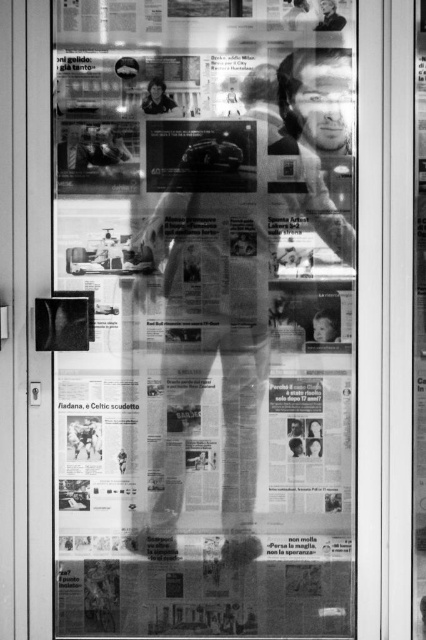
You are a graphic designer who needs to ensure that the printed paper poster at center is visible over the smooth skin person at upper center. Based on their heights, will the poster cover the person?

The printed paper poster at center has a greater height compared to smooth skin person at upper center, so yes, the poster will cover the person.

You are a graphic designer who needs to place a new advertisement on the printed paper poster at center. However, you notice the smooth skin person at upper center is partially covering it. Can you still access the poster without moving the person?

The printed paper poster at center is positioned under the smooth skin person at upper center, so you can access the poster by moving it from below the person without needing to move them.

You are a delivery person who needs to place a 24 inch wide package between the printed paper poster at center and the smooth skin person at upper center. Can the package fit in the space between them?

The distance between the printed paper poster at center and the smooth skin person at upper center is 23.04 inches. Since the package is 24 inches wide, it cannot fit in the space between them.